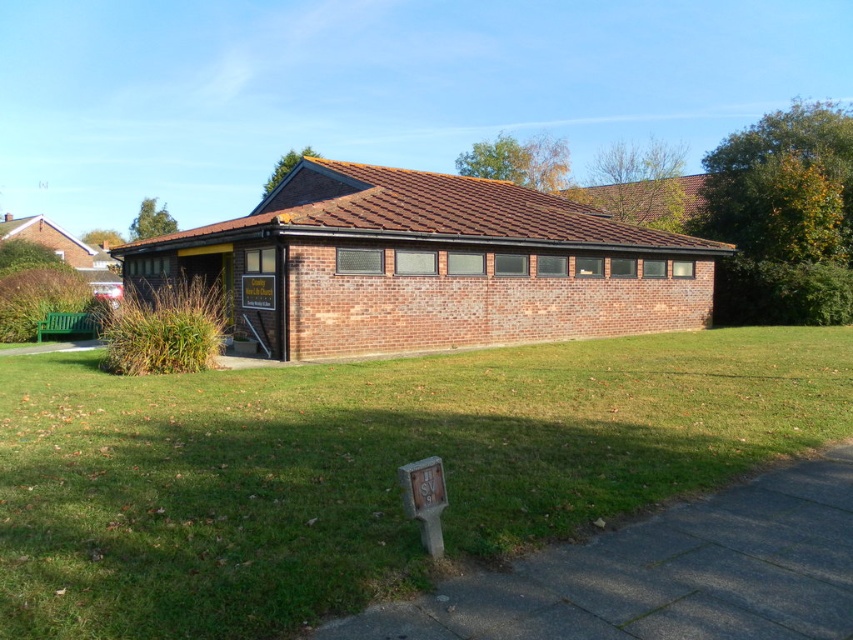
Question: Does green grass at center appear under brick building at center?

Choices:
 (A) yes
 (B) no

Answer: (A)

Question: Which point appears farthest from the camera in this image?

Choices:
 (A) (39, 538)
 (B) (323, 314)

Answer: (B)

Question: Is green grass at center smaller than brick building at center?

Choices:
 (A) yes
 (B) no

Answer: (A)

Question: Where is green grass at center located in relation to brick building at center in the image?

Choices:
 (A) right
 (B) left

Answer: (A)

Question: Which point is closer to the camera?

Choices:
 (A) brick building at center
 (B) green grass at center

Answer: (B)

Question: Among these objects, which one is nearest to the camera?

Choices:
 (A) brick building at center
 (B) green grass at center

Answer: (B)